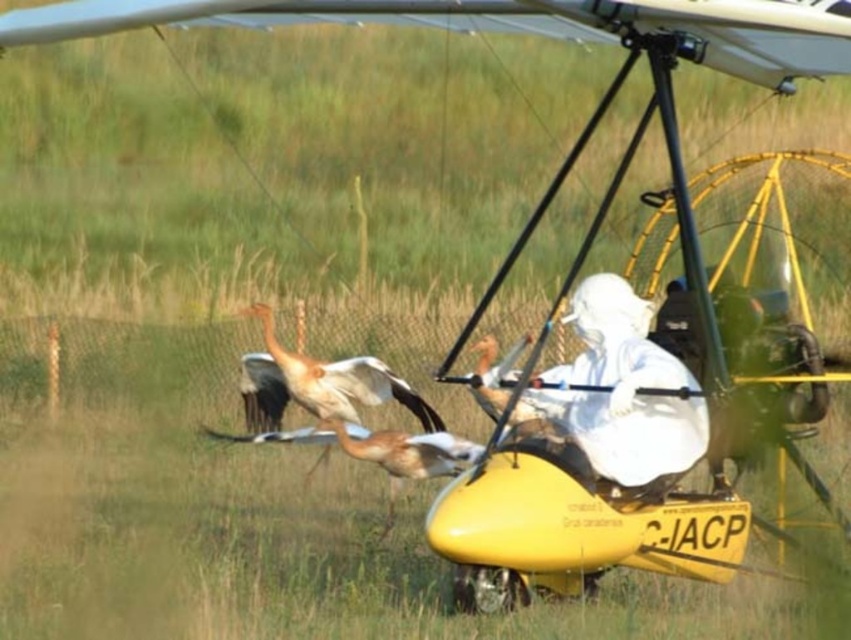
Can you confirm if white matte suit at center is smaller than white feathered bird at center?

Yes, white matte suit at center is smaller than white feathered bird at center.

How far apart are white matte suit at center and white feathered bird at center?

A distance of 8.21 feet exists between white matte suit at center and white feathered bird at center.

Who is more forward, (x=481, y=365) or (x=306, y=396)?

Point (x=481, y=365) is in front.

At what (x,y) coordinates should I click in order to perform the action: click on white matte suit at center. Please return your answer as a coordinate pair (x, y). This screenshot has height=640, width=851. Looking at the image, I should click on [x=620, y=392].

Does white feathered bird at center appear over brown feathered bird at center?

Correct, white feathered bird at center is located above brown feathered bird at center.

Is white feathered bird at center thinner than brown feathered bird at center?

Yes, white feathered bird at center is thinner than brown feathered bird at center.

Is point (273, 380) closer to camera compared to point (306, 429)?

No, (273, 380) is further to viewer.

Locate an element on the screen. The width and height of the screenshot is (851, 640). white feathered bird at center is located at coordinates (318, 384).

Is white matte suit at center shorter than brown feathered bird at center?

No, white matte suit at center is not shorter than brown feathered bird at center.

Is white matte suit at center further to the viewer compared to brown feathered bird at center?

No, white matte suit at center is closer to the viewer.

What do you see at coordinates (620, 392) in the screenshot? I see `white matte suit at center` at bounding box center [620, 392].

Locate an element on the screen. The width and height of the screenshot is (851, 640). white matte suit at center is located at coordinates (620, 392).